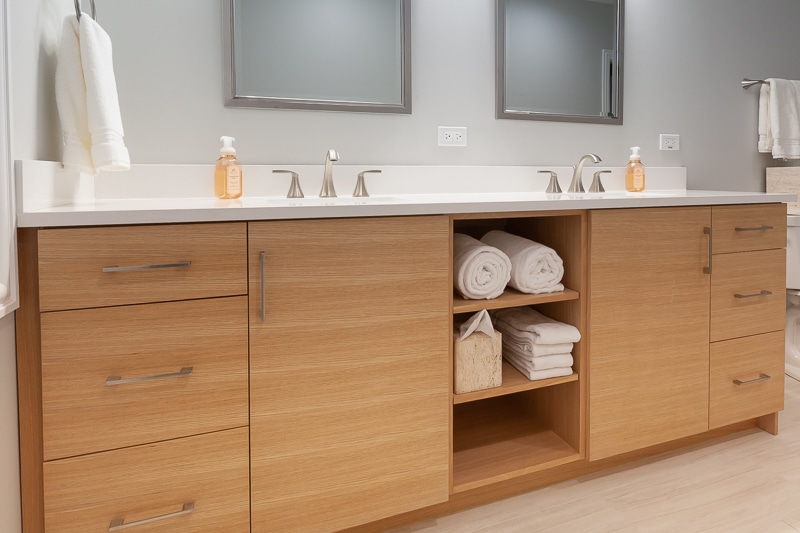
The width and height of the screenshot is (800, 533). Identify the location of soap dispenser (left). (222, 167).